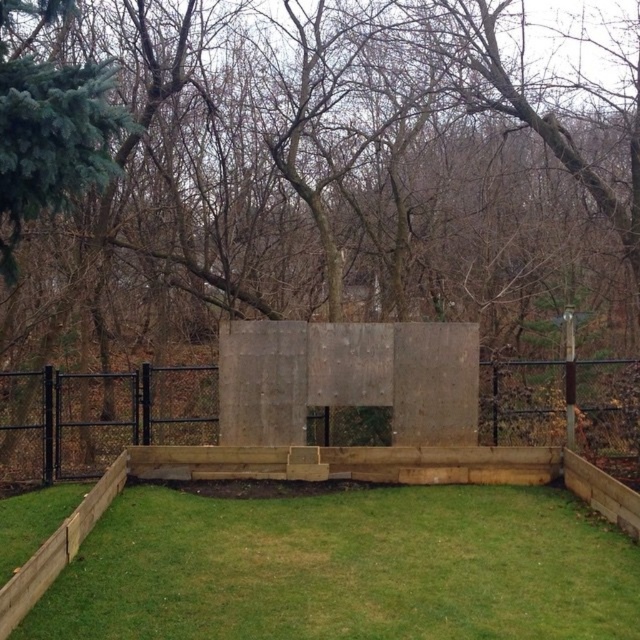
You are designing a garden layout and want to place a decorative stone path between the green leafy tree at center and the green grass at lower center. Considering their sizes, which object should the path be closer to?

The path should be closer to the green grass at lower center because the green leafy tree at center is wider, so placing the path near the narrower green grass at lower center would allow more space around the tree.